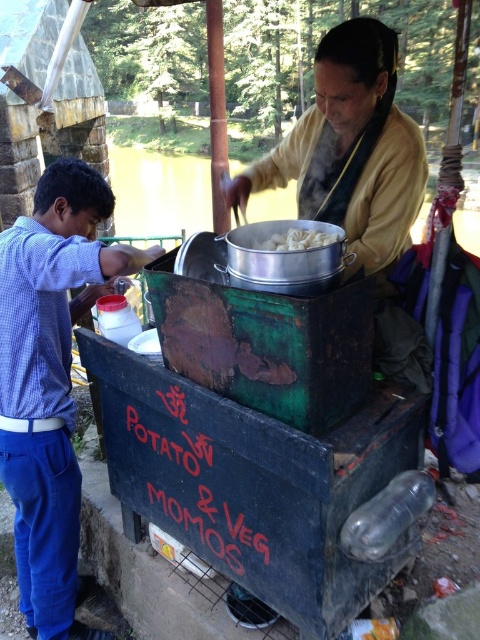
Question: Is matte yellow shirt at center wider than white matte pot at center?

Choices:
 (A) yes
 (B) no

Answer: (A)

Question: Is blue checkered shirt at left to the left of matte yellow shirt at center from the viewer's perspective?

Choices:
 (A) no
 (B) yes

Answer: (B)

Question: Which object is farther from the camera taking this photo?

Choices:
 (A) white matte pot at center
 (B) blue checkered shirt at left

Answer: (B)

Question: Which is nearer to the white matte pot at center?

Choices:
 (A) blue checkered shirt at left
 (B) matte yellow shirt at center

Answer: (B)

Question: Is blue checkered shirt at left smaller than matte yellow shirt at center?

Choices:
 (A) no
 (B) yes

Answer: (B)

Question: Which of the following is the closest to the observer?

Choices:
 (A) (232, 180)
 (B) (45, 465)

Answer: (B)